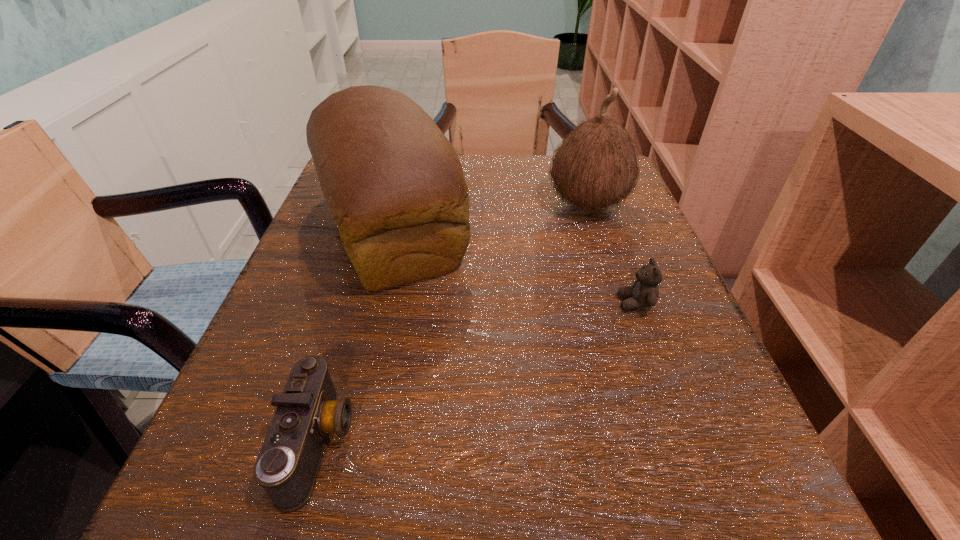
This screenshot has height=540, width=960. What are the coordinates of `vacant space that satisfies the following two spatial constraints: 1. on the surface of the coconut; 2. on the front side of the bread` in the screenshot? It's located at (595, 229).